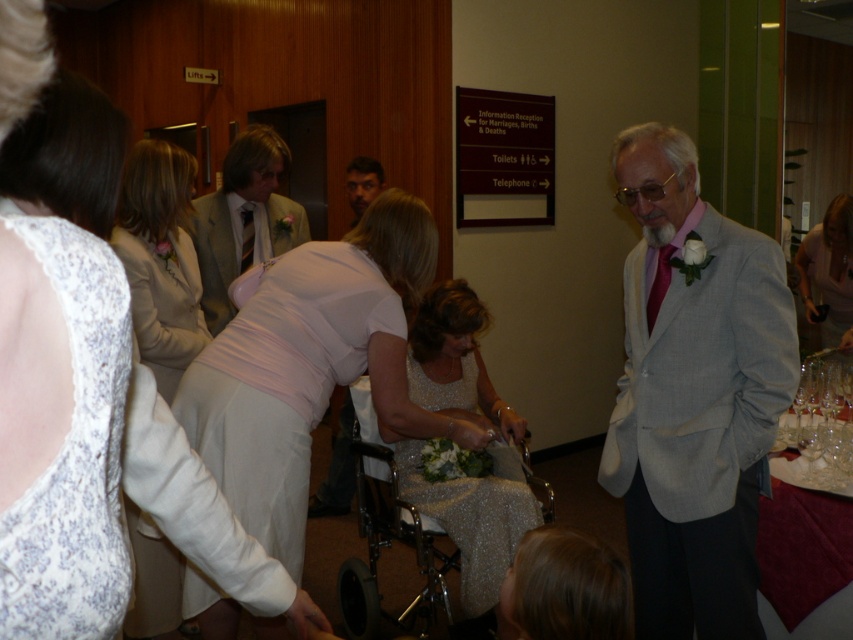
You are an event planner assessing the layout of the event space. You notice the light gray suit at center and the light pink satin dress at center. Which one is positioned higher in the image?

The light gray suit at center is positioned higher because it is above the light pink satin dress at center.

You are a photographer at the event and need to ensure the light gray suit at center and dark brown hair at center are both visible in the photo. Given their sizes, which one might you need to adjust your camera angle to better include in the frame?

The light gray suit at center is larger in size than dark brown hair at center, so you might need to adjust your camera angle to better include the light gray suit at center in the frame.